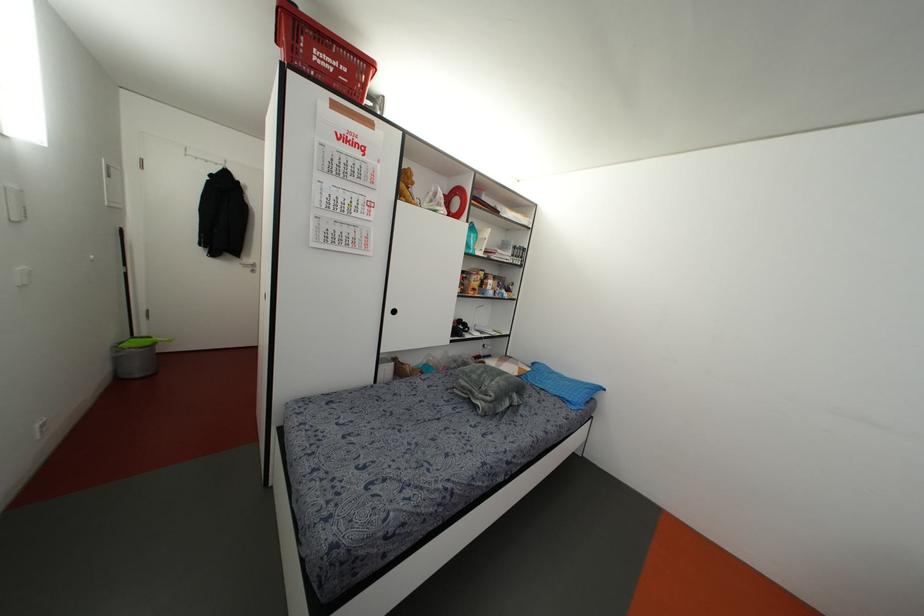
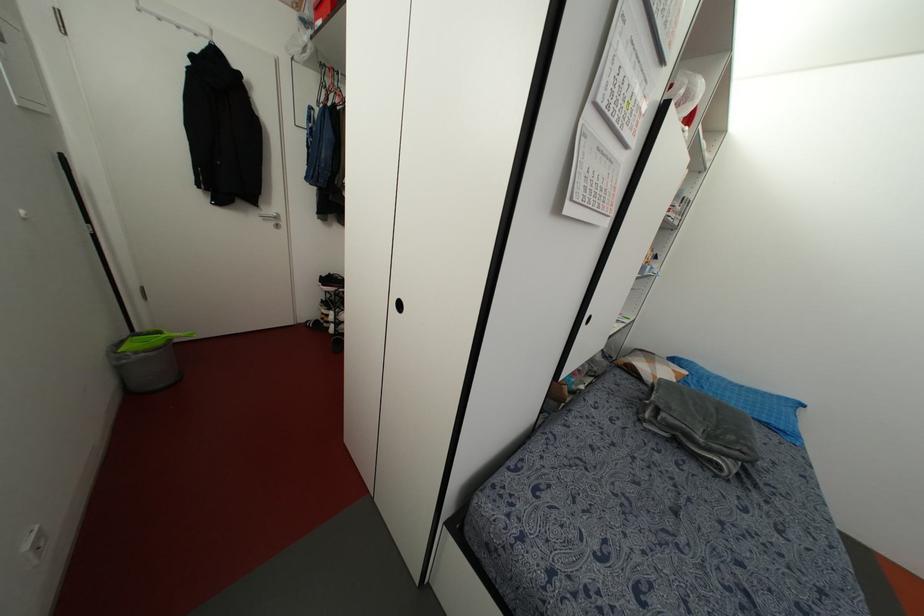
The images are taken continuously from a first-person perspective. In which direction are you moving?

The cameraman walked toward left, forward.